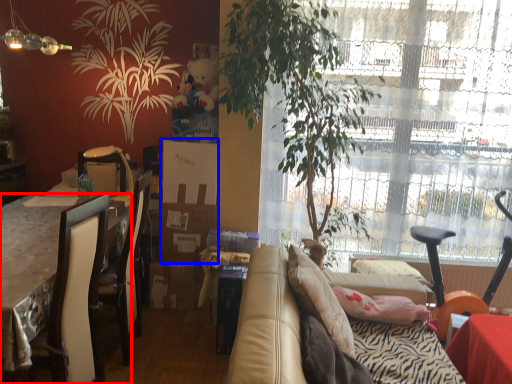
Question: Which object appears closest to the camera in this image, desk (highlighted by a red box) or box (highlighted by a blue box)?

Choices:
 (A) desk
 (B) box

Answer: (A)